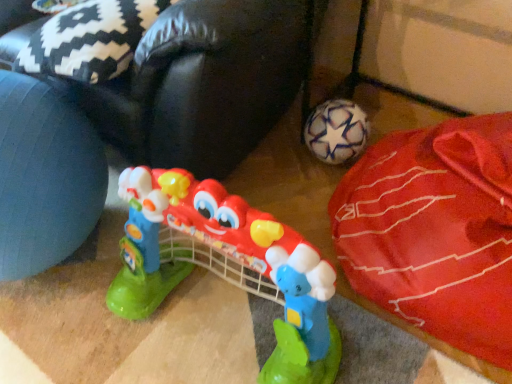
Question: Does white matte soccer ball at lower right come in front of plastic toy guitar at center?

Choices:
 (A) no
 (B) yes

Answer: (A)

Question: Can you confirm if white matte soccer ball at lower right is positioned to the right of plastic toy guitar at center?

Choices:
 (A) yes
 (B) no

Answer: (A)

Question: From the image's perspective, is white matte soccer ball at lower right under plastic toy guitar at center?

Choices:
 (A) no
 (B) yes

Answer: (A)

Question: From a real-world perspective, does white matte soccer ball at lower right sit lower than plastic toy guitar at center?

Choices:
 (A) yes
 (B) no

Answer: (A)

Question: Can you confirm if white matte soccer ball at lower right is thinner than plastic toy guitar at center?

Choices:
 (A) yes
 (B) no

Answer: (B)

Question: Considering the positions of point (446, 236) and point (164, 271), is point (446, 236) closer or farther from the camera than point (164, 271)?

Choices:
 (A) farther
 (B) closer

Answer: (B)

Question: Considering the positions of white matte soccer ball at lower right and plastic toy guitar at center in the image, is white matte soccer ball at lower right bigger or smaller than plastic toy guitar at center?

Choices:
 (A) big
 (B) small

Answer: (A)

Question: In the image, is white matte soccer ball at lower right on the left side or the right side of plastic toy guitar at center?

Choices:
 (A) right
 (B) left

Answer: (A)

Question: From the image's perspective, is white matte soccer ball at lower right above or below plastic toy guitar at center?

Choices:
 (A) below
 (B) above

Answer: (B)

Question: Considering their positions, is red fabric bean bag at lower right located in front of or behind white matte soccer ball at lower right?

Choices:
 (A) behind
 (B) front

Answer: (A)

Question: In terms of size, does red fabric bean bag at lower right appear bigger or smaller than white matte soccer ball at lower right?

Choices:
 (A) big
 (B) small

Answer: (A)

Question: Is red fabric bean bag at lower right to the left or to the right of white matte soccer ball at lower right in the image?

Choices:
 (A) right
 (B) left

Answer: (B)

Question: In terms of width, does red fabric bean bag at lower right look wider or thinner when compared to white matte soccer ball at lower right?

Choices:
 (A) wide
 (B) thin

Answer: (A)

Question: Would you say white matte soccer ball at lower right is inside or outside red fabric bean bag at lower right?

Choices:
 (A) outside
 (B) inside

Answer: (A)

Question: In terms of width, does white matte soccer ball at lower right look wider or thinner when compared to red fabric bean bag at lower right?

Choices:
 (A) wide
 (B) thin

Answer: (B)